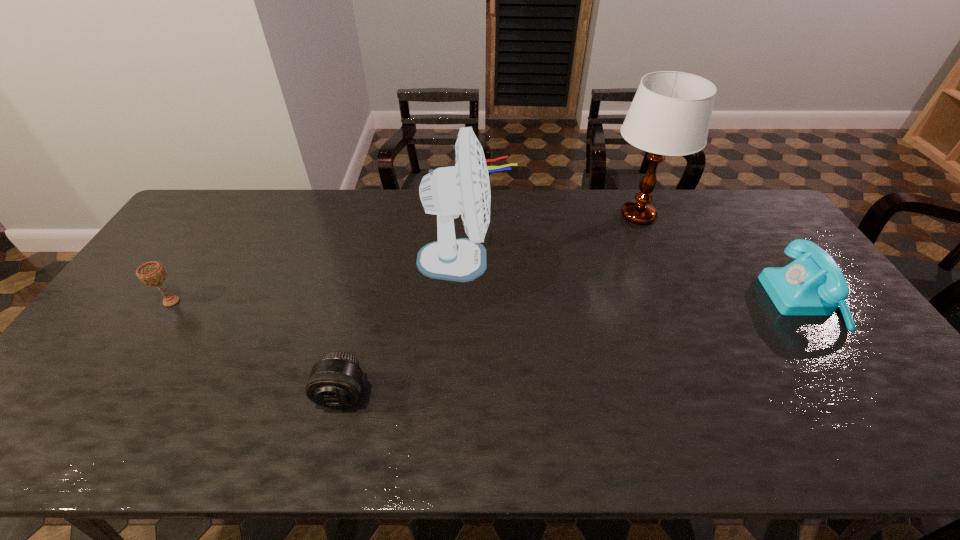
In order to click on free region at the near left corner of the desktop in this screenshot , I will do `click(80, 442)`.

At what (x,y) coordinates should I click in order to perform the action: click on free area in between the table lamp and the rightmost object. Please return your answer as a coordinate pair (x, y). Looking at the image, I should click on (722, 258).

Image resolution: width=960 pixels, height=540 pixels. I want to click on vacant space that's between the telephone and the leftmost object, so click(489, 301).

At what (x,y) coordinates should I click in order to perform the action: click on free space between the fan and the table lamp. Please return your answer as a coordinate pair (x, y). Image resolution: width=960 pixels, height=540 pixels. Looking at the image, I should click on (552, 238).

You are a GUI agent. You are given a task and a screenshot of the screen. Output one action in this format:
    pyautogui.click(x=<x>, y=<y>)
    Task: Click on the unoccupied area between the leftmost object and the third object from left to right
    The width and height of the screenshot is (960, 540).
    Given the screenshot: What is the action you would take?
    pyautogui.click(x=319, y=281)

Locate an element on the screen. free space between the third object from left to right and the table lamp is located at coordinates (552, 238).

This screenshot has width=960, height=540. What are the coordinates of `empty space between the fourth object from left to right and the leftmost object` in the screenshot? It's located at (405, 259).

The image size is (960, 540). Find the location of `vacant area that lies between the fourth object from left to right and the telephone`. vacant area that lies between the fourth object from left to right and the telephone is located at coordinates (722, 258).

In order to click on vacant region between the table lamp and the telephone in this screenshot , I will do `click(722, 258)`.

Where is `unoccupied position between the chalice and the fan`? The width and height of the screenshot is (960, 540). unoccupied position between the chalice and the fan is located at coordinates (319, 281).